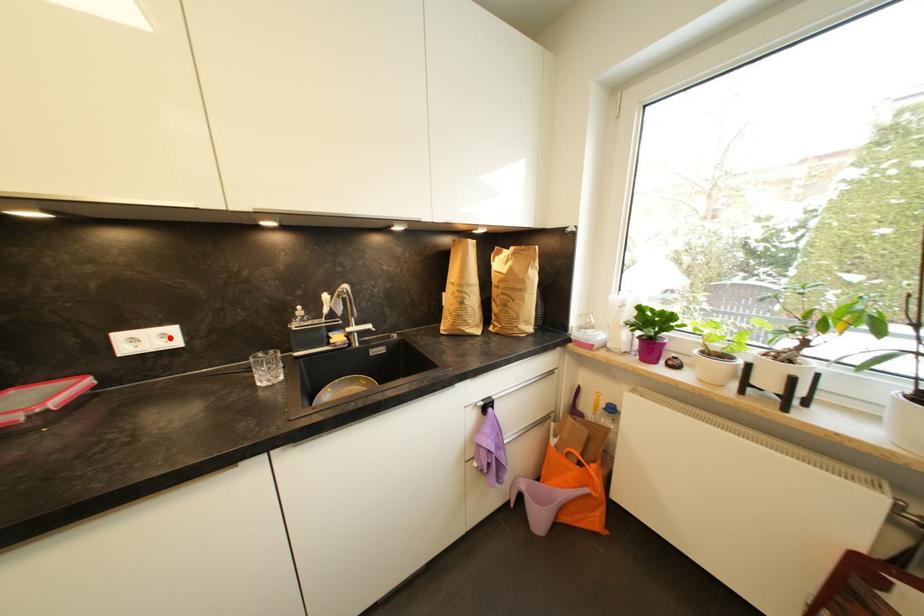
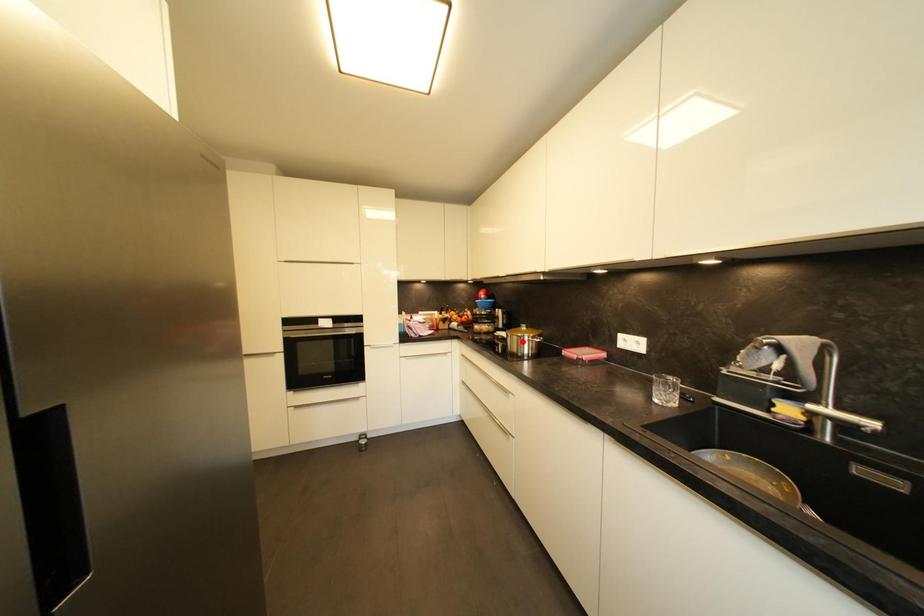
I am providing you with two images of the same scene from different viewpoints. A red point is marked on the first image and another point is marked on the second image. Is the marked point in image1 the same physical position as the marked point in image2?

No